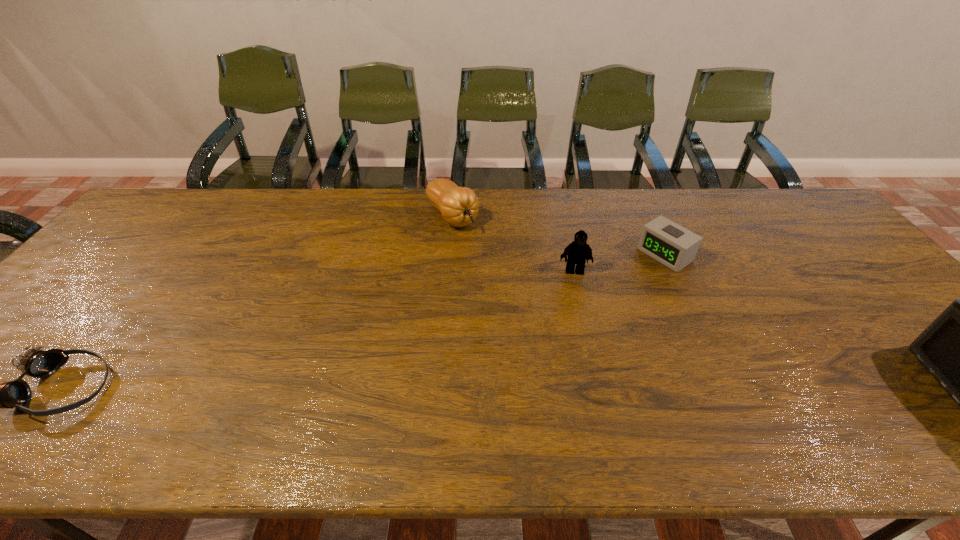
Find the location of a particular element. free spot located on the face of the Lego is located at coordinates (584, 394).

You are a GUI agent. You are given a task and a screenshot of the screen. Output one action in this format:
    pyautogui.click(x=<x>, y=<y>)
    Task: Click on the vacant space located on the front-facing side of the fourth tallest object
    The height and width of the screenshot is (540, 960).
    Given the screenshot: What is the action you would take?
    pyautogui.click(x=601, y=298)

What are the coordinates of `vacant space situated 0.210m on the front-facing side of the fourth tallest object` in the screenshot? It's located at (601, 298).

Locate an element on the screen. The width and height of the screenshot is (960, 540). vacant space located on the front-facing side of the fourth tallest object is located at coordinates (598, 300).

Identify the location of object that is at the far edge. This screenshot has height=540, width=960. (459, 206).

Locate an element on the screen. This screenshot has height=540, width=960. vacant space at the far edge of the desktop is located at coordinates (732, 223).

The image size is (960, 540). In order to click on vacant space at the near edge of the desktop in this screenshot , I will do `click(431, 400)`.

In the image, there is a desktop. Where is `vacant space at the left edge`? Image resolution: width=960 pixels, height=540 pixels. vacant space at the left edge is located at coordinates (174, 232).

In the image, there is a desktop. At what (x,y) coordinates should I click in order to perform the action: click on vacant space at the right edge. Please return your answer as a coordinate pair (x, y). Looking at the image, I should click on pyautogui.click(x=890, y=312).

Identify the location of blank space at the far left corner of the desktop. (171, 217).